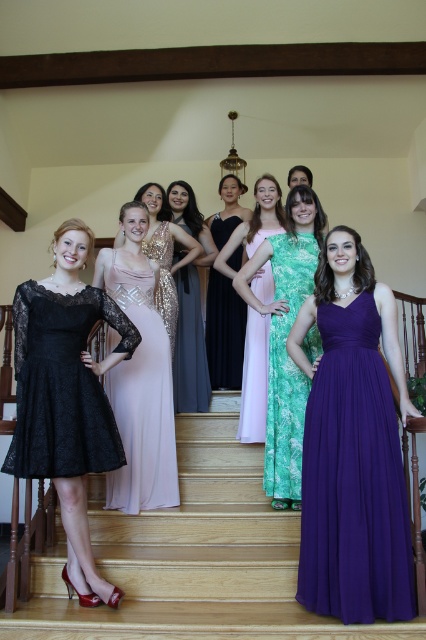
You are a photographer at the event and want to capture a photo that includes both the light pink sequined dress at center and the satin sequined dress at center. Based on their positions, which dress should you focus on first to ensure both are in frame?

The light pink sequined dress at center is positioned on the left side of the satin sequined dress at center. To ensure both are in frame, focus on the light pink sequined dress at center first, then adjust to include the satin sequined dress at center on the right.

Consider the image. You are standing at the bottom of the staircase and want to take a photo of the two points mentioned. Which point, point (134, 388) or point (203, 330), will appear larger in your photo?

Point (134, 388) is closer to the viewer than point (203, 330), so it will appear larger in the photo.

You are a photographer at the event and want to capture a photo of the lace fabric dress at lower left and the green floral dress at center. From the photographer position, which dress is positioned lower in the frame?

The lace fabric dress at lower left is positioned lower in the frame than the green floral dress at center.